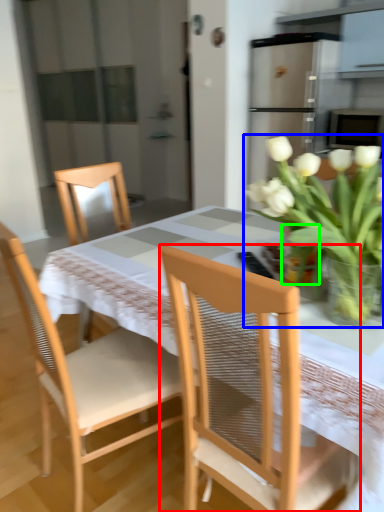
Question: Which is farther away from chair (highlighted by a red box)? houseplant (highlighted by a blue box) or glass vase (highlighted by a green box)?

Choices:
 (A) houseplant
 (B) glass vase

Answer: (B)